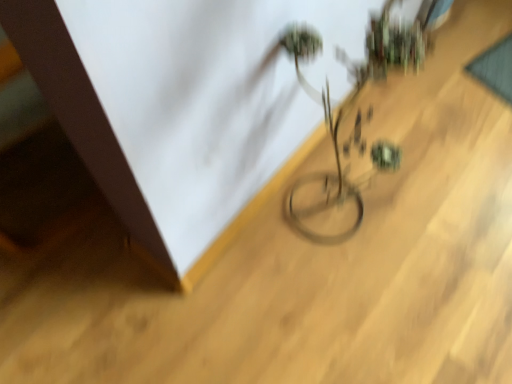
You are a GUI agent. You are given a task and a screenshot of the screen. Output one action in this format:
    pyautogui.click(x=<x>, y=<y>)
    Task: Click on the green matte houseplant at center
    This screenshot has width=512, height=384.
    Given the screenshot: What is the action you would take?
    pyautogui.click(x=354, y=96)

What is the approximate height of green matte houseplant at center?

The height of green matte houseplant at center is 31.22 inches.

What is the approximate width of green matte houseplant at center?

The width of green matte houseplant at center is 27.01 centimeters.

Looking at this image, measure the distance between point (367, 69) and camera.

32.64 inches.

Describe the element at coordinates (354, 96) in the screenshot. This screenshot has height=384, width=512. I see `green matte houseplant at center` at that location.

The height and width of the screenshot is (384, 512). I want to click on green matte houseplant at center, so click(354, 96).